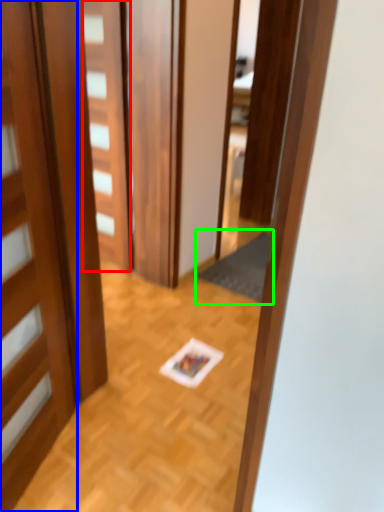
Question: Which object is positioned closest to door (highlighted by a red box)? Select from door (highlighted by a blue box) and doormat (highlighted by a green box).

Choices:
 (A) door
 (B) doormat

Answer: (B)